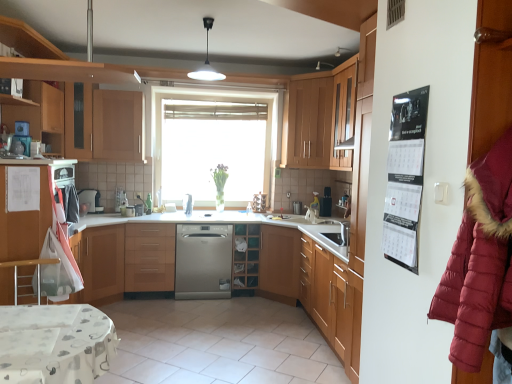
Question: From the image's perspective, is wooden cabinet at upper center, the fourth cabinetry when ordered from left to right, over satin silver dishwasher at center, the first appliance viewed from the left?

Choices:
 (A) yes
 (B) no

Answer: (A)

Question: Is wooden cabinet at upper center, which is the 2th cabinetry from right to left, shorter than satin silver dishwasher at center, the fourth appliance when ordered from back to front?

Choices:
 (A) no
 (B) yes

Answer: (A)

Question: Is wooden cabinet at upper center, which is the 2th cabinetry from right to left, positioned with its back to satin silver dishwasher at center, the first appliance viewed from the left?

Choices:
 (A) no
 (B) yes

Answer: (A)

Question: From the image's perspective, is wooden cabinet at upper center, the fourth cabinetry when ordered from left to right, located beneath satin silver dishwasher at center, the first appliance viewed from the left?

Choices:
 (A) yes
 (B) no

Answer: (B)

Question: Is there a large distance between wooden cabinet at upper center, which is the 2th cabinetry from right to left, and satin silver dishwasher at center, which is counted as the 1th appliance, starting from the front?

Choices:
 (A) yes
 (B) no

Answer: (A)

Question: Is satin silver dishwasher at center, which is counted as the 1th appliance, starting from the front, taller or shorter than white glossy light fixture at upper center?

Choices:
 (A) tall
 (B) short

Answer: (B)

Question: Is point (93, 205) closer or farther from the camera than point (203, 21)?

Choices:
 (A) closer
 (B) farther

Answer: (B)

Question: Considering the positions of satin silver dishwasher at center, the 4th appliance positioned from the right, and white glossy light fixture at upper center in the image, is satin silver dishwasher at center, the 4th appliance positioned from the right, bigger or smaller than white glossy light fixture at upper center?

Choices:
 (A) big
 (B) small

Answer: (B)

Question: From the image's perspective, is satin silver dishwasher at center, which is counted as the 1th appliance, starting from the front, positioned above or below white glossy light fixture at upper center?

Choices:
 (A) below
 (B) above

Answer: (A)

Question: Is point (47, 208) positioned closer to the camera than point (237, 226)?

Choices:
 (A) closer
 (B) farther

Answer: (A)

Question: Is white glossy refrigerator at left, which is the fifth cabinetry from right to left, taller or shorter than wooden wine rack at center?

Choices:
 (A) tall
 (B) short

Answer: (A)

Question: Is white glossy refrigerator at left, marked as the 1th cabinetry in a left-to-right arrangement, in front of or behind wooden wine rack at center in the image?

Choices:
 (A) front
 (B) behind

Answer: (A)

Question: Is white glossy refrigerator at left, marked as the 1th cabinetry in a left-to-right arrangement, bigger or smaller than wooden wine rack at center?

Choices:
 (A) small
 (B) big

Answer: (B)

Question: From their relative heights in the image, would you say metallic silver bar stool at lower left is taller or shorter than white glossy refrigerator at left, which is the fifth cabinetry from right to left?

Choices:
 (A) tall
 (B) short

Answer: (B)

Question: Which is correct: metallic silver bar stool at lower left is inside white glossy refrigerator at left, which is the fifth cabinetry from right to left, or outside of it?

Choices:
 (A) inside
 (B) outside

Answer: (B)